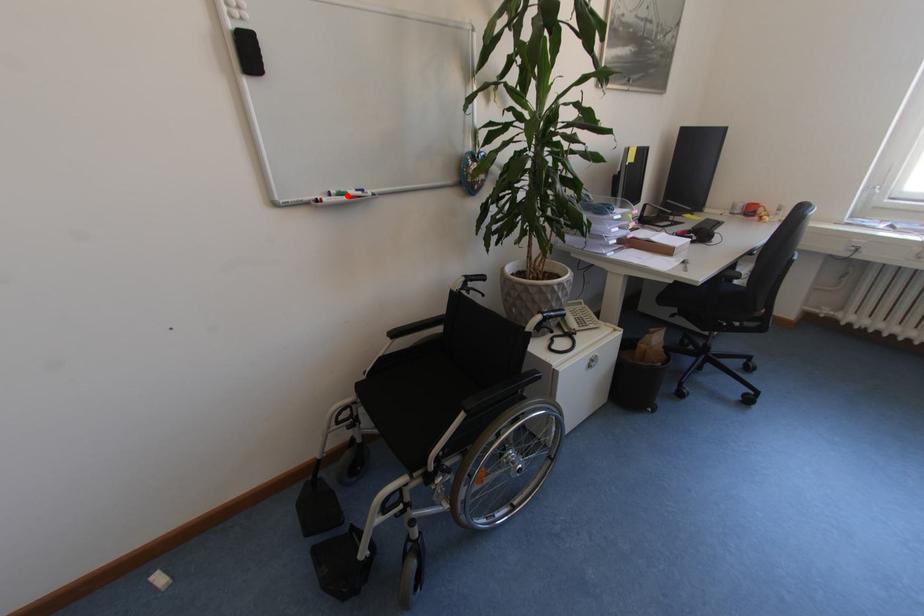
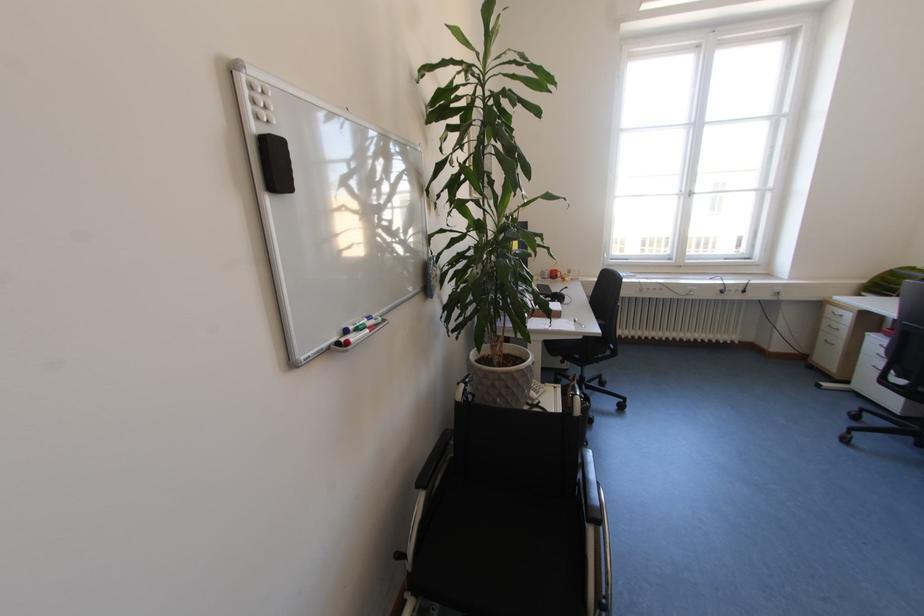
Where in the second image is the point corresponding to the highlighted location from the first image?

(366, 330)